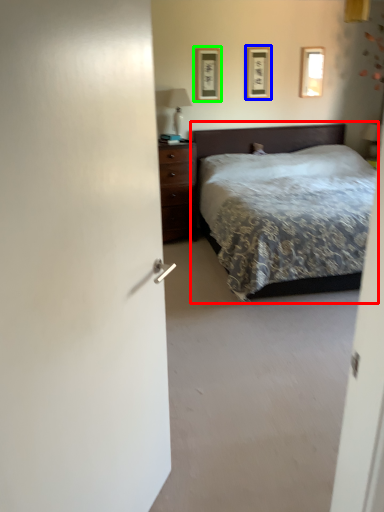
Question: Which object is positioned farthest from bed (highlighted by a red box)? Select from picture frame (highlighted by a blue box) and picture frame (highlighted by a green box).

Choices:
 (A) picture frame
 (B) picture frame

Answer: (B)